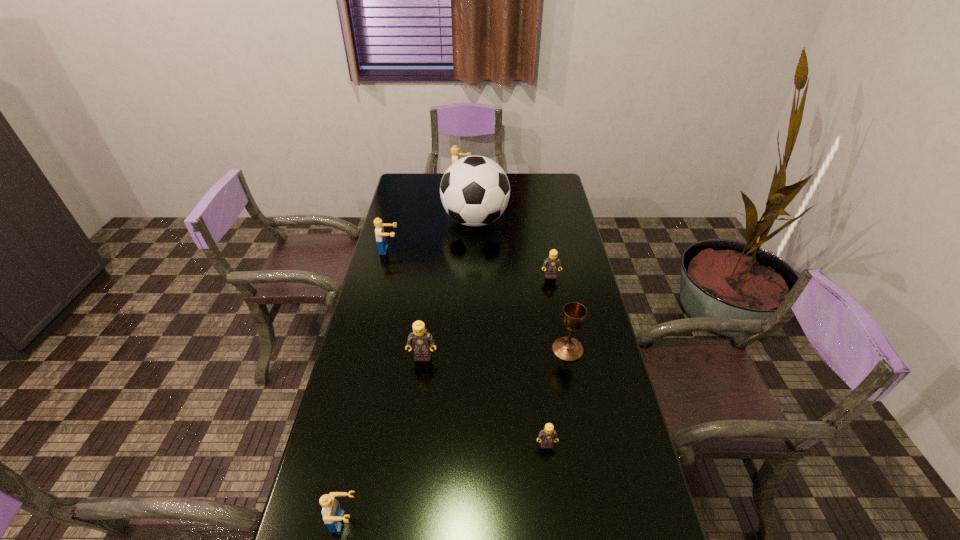
This screenshot has height=540, width=960. What are the coordinates of `the nearest Lego` in the screenshot? It's located at (332, 514).

What are the coordinates of `the second smallest tan Lego` in the screenshot? It's located at pyautogui.click(x=552, y=263).

At what (x,y) coordinates should I click in order to perform the action: click on the rightmost tan Lego. Please return your answer as a coordinate pair (x, y). This screenshot has width=960, height=540. Looking at the image, I should click on (552, 263).

This screenshot has height=540, width=960. Identify the location of the fifth Lego from left to right. (547, 436).

Where is `the seventh farthest object`? the seventh farthest object is located at coordinates (547, 436).

You are a GUI agent. You are given a task and a screenshot of the screen. Output one action in this format:
    pyautogui.click(x=<x>, y=<y>)
    Task: Click on the free spot located on the back of the soccer ball
    
    Given the screenshot: What is the action you would take?
    pyautogui.click(x=476, y=193)

At what (x,y) coordinates should I click in order to perform the action: click on blank space located on the face of the farthest Lego. Please return your answer as a coordinate pair (x, y). This screenshot has height=540, width=960. Looking at the image, I should click on (544, 180).

I want to click on free space located on the front of the chalice, so click(586, 443).

Where is `vacant space positioned 0.330m on the face of the third farthest object`? Image resolution: width=960 pixels, height=540 pixels. vacant space positioned 0.330m on the face of the third farthest object is located at coordinates (482, 251).

Locate an element on the screen. The width and height of the screenshot is (960, 540). vacant space situated in front of the biggest tan Lego is located at coordinates (405, 497).